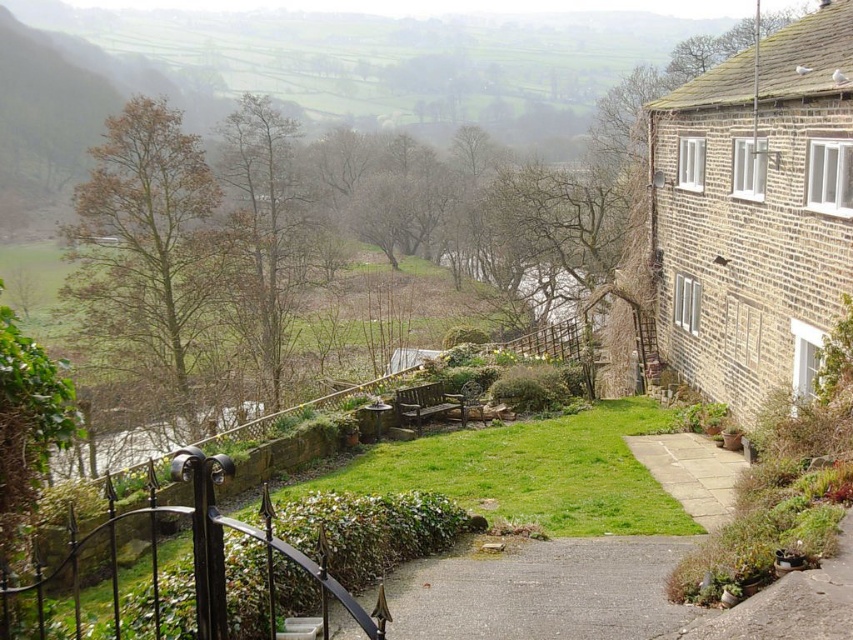
Question: Observing the image, what is the correct spatial positioning of gray gravel path at center in reference to light gray stone path at center?

Choices:
 (A) right
 (B) left

Answer: (B)

Question: Among these objects, which one is farthest from the camera?

Choices:
 (A) light gray stone path at center
 (B) gray gravel path at center

Answer: (A)

Question: From the image, what is the correct spatial relationship of gray gravel path at center in relation to light gray stone path at center?

Choices:
 (A) above
 (B) below

Answer: (A)

Question: Is gray gravel path at center below light gray stone path at center?

Choices:
 (A) yes
 (B) no

Answer: (B)